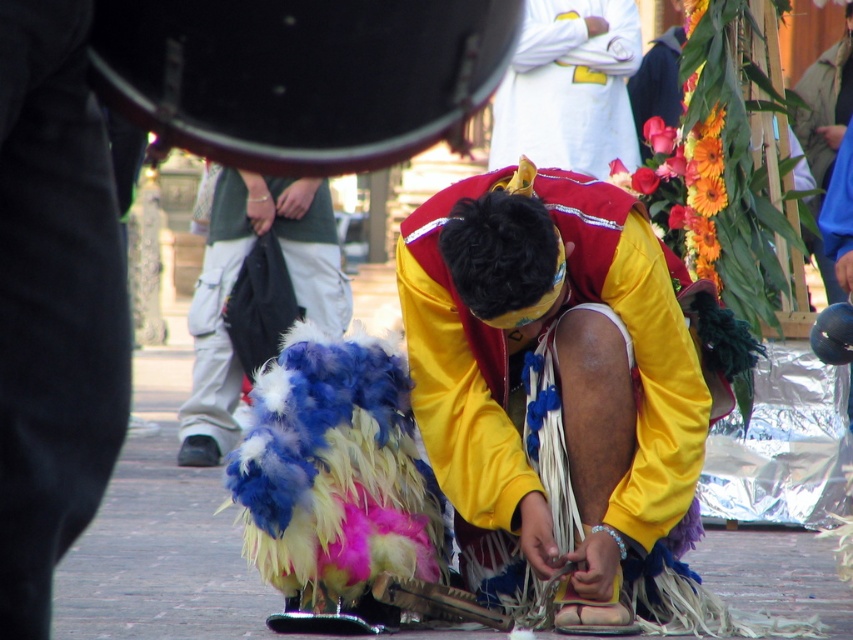
You are an observer at this traditional ceremony. You notice the yellow fabric at center and the feathered costume at center. Which object is located to the right of the other?

The yellow fabric at center is positioned on the right side of feathered costume at center.

You are an observer at the ceremony. You notice the yellow fabric at center and the white cotton shirt at upper center. Which object is positioned to the right side of the other?

The white cotton shirt at upper center is positioned to the right of the yellow fabric at center.

You are an observer at the ceremony. You notice two items in the scene described as the yellow fabric at center and the white cotton shirt at upper center. Which of these two items is smaller in size?

The yellow fabric at center is smaller than the white cotton shirt at upper center.